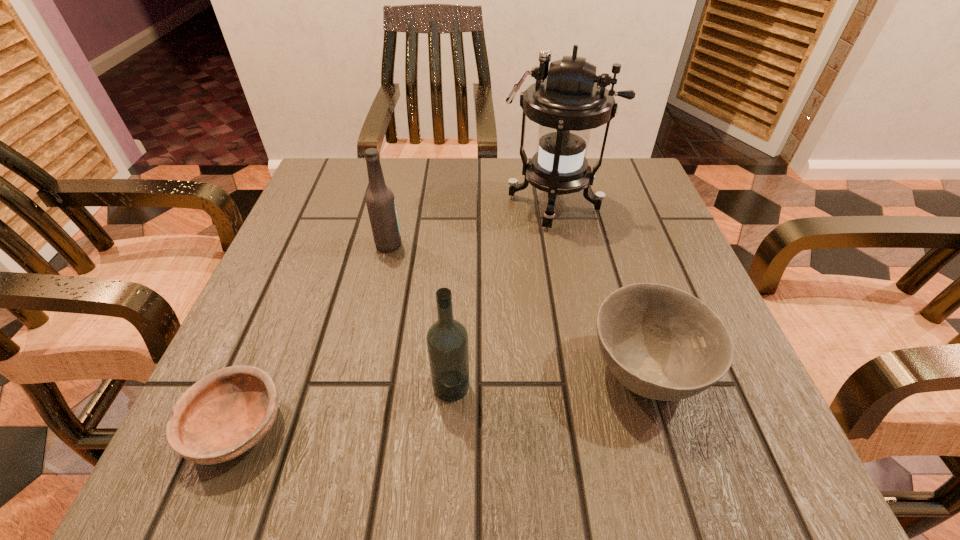
Identify the location of vacant space located on the label of the second farthest object. This screenshot has width=960, height=540. pyautogui.click(x=532, y=245).

This screenshot has width=960, height=540. I want to click on free region located on the right of the third object from right to left, so click(590, 386).

The width and height of the screenshot is (960, 540). In order to click on vacant position located on the back of the fourth tallest object in this screenshot , I will do `click(616, 284)`.

I want to click on vacant area situated 0.250m on the right of the leftmost object, so click(468, 427).

Image resolution: width=960 pixels, height=540 pixels. I want to click on object situated at the far edge, so click(569, 100).

Locate an element on the screen. The image size is (960, 540). object positioned at the left edge is located at coordinates (226, 413).

I want to click on lantern present at the right edge, so click(569, 100).

You are a GUI agent. You are given a task and a screenshot of the screen. Output one action in this format:
    pyautogui.click(x=<x>, y=<y>)
    Task: Click on the bowl positioned at the right edge
    This screenshot has width=960, height=540.
    Given the screenshot: What is the action you would take?
    [662, 343]

Where is `object located in the near left corner section of the desktop`? This screenshot has height=540, width=960. object located in the near left corner section of the desktop is located at coordinates (226, 413).

What are the coordinates of `object situated at the far right corner` in the screenshot? It's located at point(569,100).